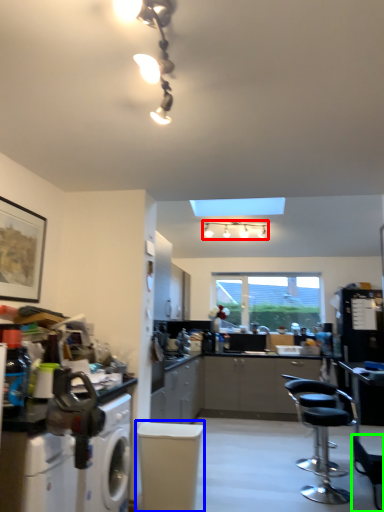
Question: Which object is the closest to the lamp (highlighted by a red box)? Choose among these: swivel chair (highlighted by a blue box) or chair (highlighted by a green box).

Choices:
 (A) swivel chair
 (B) chair

Answer: (B)